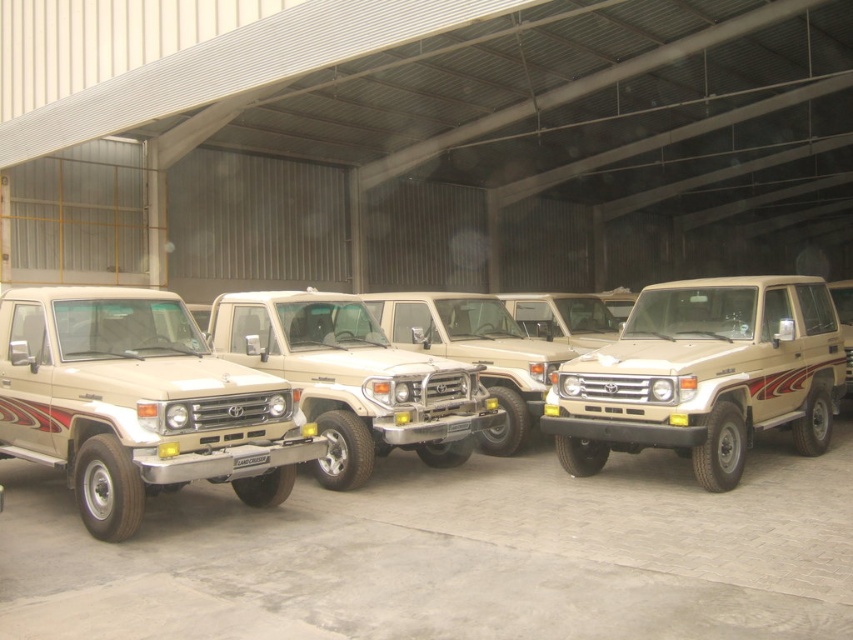
Question: Which object is closer to the camera taking this photo?

Choices:
 (A) satin beige jeep at center
 (B) matte beige jeep at center

Answer: (B)

Question: Is beige matte/soft plastic jeep at left smaller than satin beige jeep at center?

Choices:
 (A) yes
 (B) no

Answer: (B)

Question: Where is beige matte/soft plastic jeep at left located in relation to satin beige jeep at center in the image?

Choices:
 (A) right
 (B) left

Answer: (B)

Question: Is the position of beige matte/soft plastic jeep at left less distant than that of matte beige jeep at center?

Choices:
 (A) no
 (B) yes

Answer: (B)

Question: Which object is the closest to the satin beige jeep at center?

Choices:
 (A) matte beige jeep at center
 (B) beige matte/soft plastic jeep at left

Answer: (A)

Question: Which object appears closest to the camera in this image?

Choices:
 (A) matte beige jeep at center
 (B) beige matte/soft plastic jeep at left
 (C) satin beige jeep at center

Answer: (B)